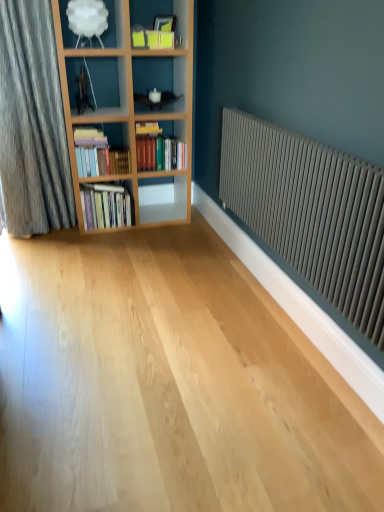
Locate an element on the screen. This screenshot has height=512, width=384. free space underneath hardcover books at center, the third book when ordered from bottom to top (from a real-world perspective) is located at coordinates pyautogui.click(x=156, y=216).